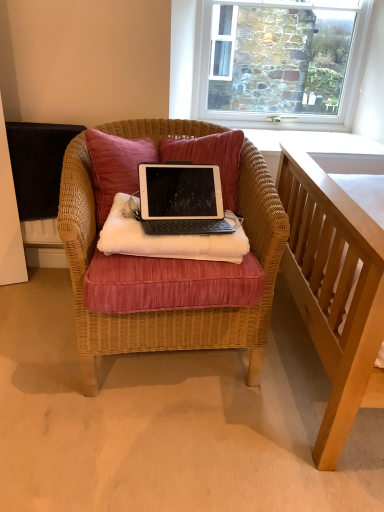
Question: Is stone textured wall at upper center positioned with its back to black matte tablet at center?

Choices:
 (A) yes
 (B) no

Answer: (B)

Question: Could you tell me if stone textured wall at upper center is turned towards black matte tablet at center?

Choices:
 (A) yes
 (B) no

Answer: (A)

Question: From the image's perspective, is stone textured wall at upper center on black matte tablet at center?

Choices:
 (A) yes
 (B) no

Answer: (A)

Question: From a real-world perspective, is stone textured wall at upper center below black matte tablet at center?

Choices:
 (A) yes
 (B) no

Answer: (B)

Question: Can you confirm if stone textured wall at upper center is smaller than black matte tablet at center?

Choices:
 (A) yes
 (B) no

Answer: (B)

Question: Considering the relative sizes of stone textured wall at upper center and black matte tablet at center in the image provided, is stone textured wall at upper center bigger than black matte tablet at center?

Choices:
 (A) no
 (B) yes

Answer: (B)

Question: Can you confirm if black matte tablet at center is thinner than velvet pink pillow at center?

Choices:
 (A) yes
 (B) no

Answer: (B)

Question: Considering the relative sizes of black matte tablet at center and velvet pink pillow at center in the image provided, is black matte tablet at center smaller than velvet pink pillow at center?

Choices:
 (A) no
 (B) yes

Answer: (B)

Question: Considering the relative sizes of black matte tablet at center and velvet pink pillow at center in the image provided, is black matte tablet at center taller than velvet pink pillow at center?

Choices:
 (A) yes
 (B) no

Answer: (B)

Question: Is black matte tablet at center positioned with its back to velvet pink pillow at center?

Choices:
 (A) no
 (B) yes

Answer: (B)

Question: Does black matte tablet at center contain velvet pink pillow at center?

Choices:
 (A) yes
 (B) no

Answer: (B)

Question: Considering the relative sizes of black matte tablet at center and velvet pink pillow at center in the image provided, is black matte tablet at center bigger than velvet pink pillow at center?

Choices:
 (A) no
 (B) yes

Answer: (A)

Question: Does velvet pink pillow at center have a lesser height compared to silver/black plastic laptop at center?

Choices:
 (A) yes
 (B) no

Answer: (B)